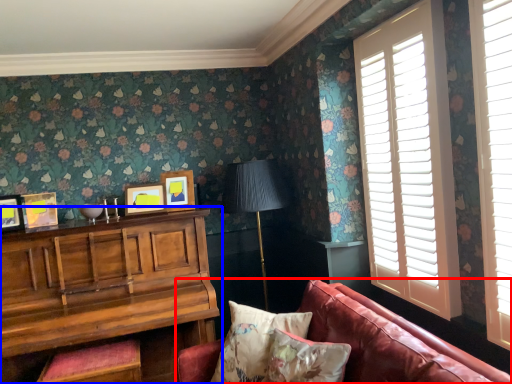
Question: Which of the following is the closest to the observer, studio couch (highlighted by a red box) or table (highlighted by a blue box)?

Choices:
 (A) studio couch
 (B) table

Answer: (A)